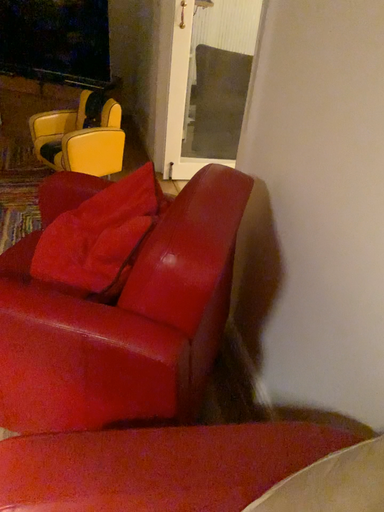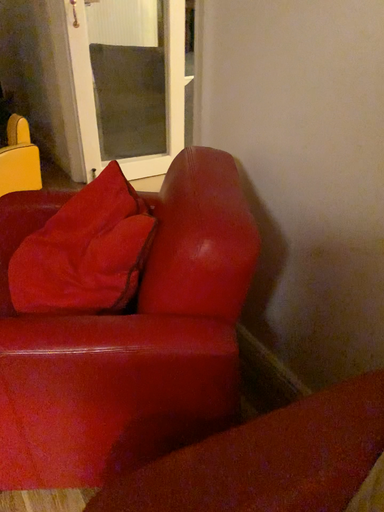
Question: How did the camera likely rotate when shooting the video?

Choices:
 (A) rotated right
 (B) rotated left

Answer: (A)